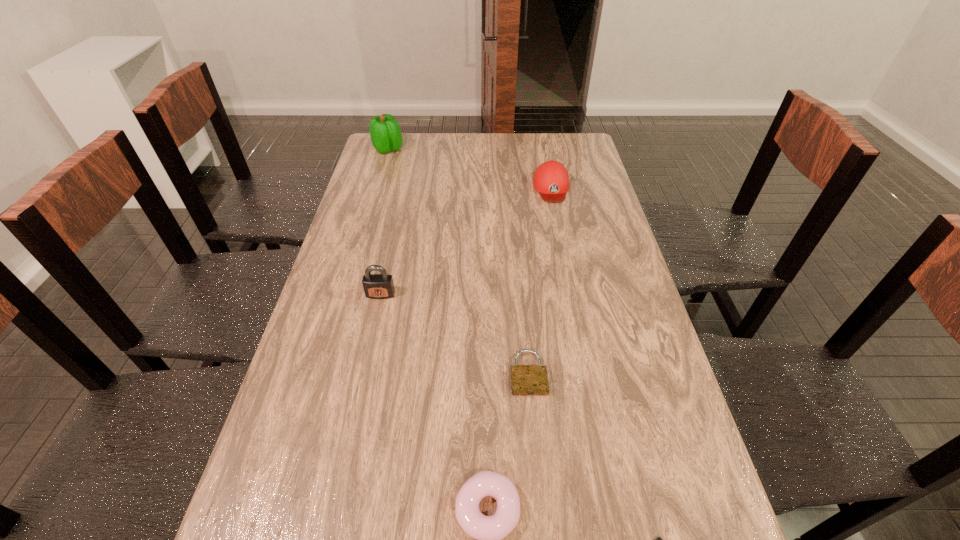
In order to click on vacant area situated on the front-facing side of the second farthest object in this screenshot , I will do point(558,217).

This screenshot has height=540, width=960. Identify the location of vacant area situated on the keyhole side of the nearer padlock. (537, 464).

Where is `object that is positioned at the far edge`? The image size is (960, 540). object that is positioned at the far edge is located at coordinates (385, 132).

Find the location of a particular element. The width and height of the screenshot is (960, 540). bell pepper that is positioned at the left edge is located at coordinates (385, 132).

Identify the location of padlock present at the left edge. (376, 286).

What are the coordinates of `object that is at the right edge` in the screenshot? It's located at (551, 180).

Image resolution: width=960 pixels, height=540 pixels. Identify the location of object that is at the far left corner. (385, 132).

You are a GUI agent. You are given a task and a screenshot of the screen. Output one action in this format:
    pyautogui.click(x=<x>, y=<y>)
    Task: Click on the vacant space at the left edge
    This screenshot has height=540, width=960.
    Given the screenshot: What is the action you would take?
    pyautogui.click(x=364, y=290)

Image resolution: width=960 pixels, height=540 pixels. Identify the location of free space at the right edge of the desktop. (566, 199).

In the image, there is a desktop. At what (x,y) coordinates should I click in order to perform the action: click on vacant space at the far right corner. Please return your answer as a coordinate pair (x, y). Looking at the image, I should click on (566, 133).